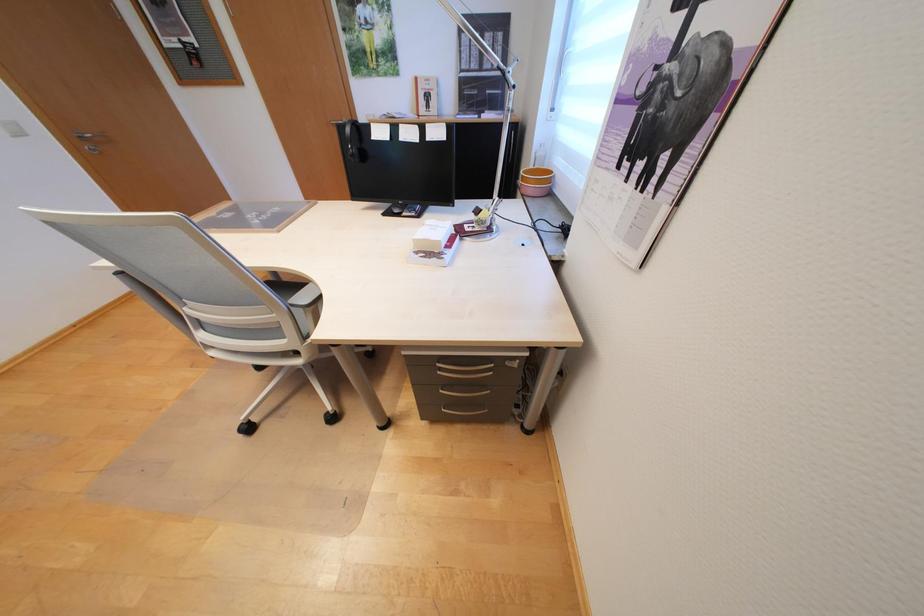
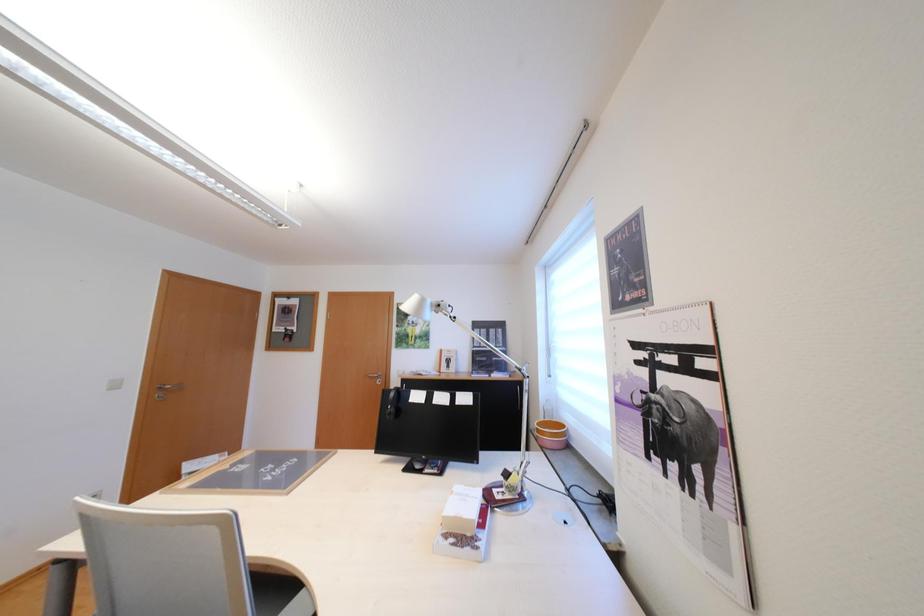
Question: Based on the continuous images, in which direction is the camera rotating? Reply with the corresponding letter.

Choices:
 (A) Left
 (B) Right
 (C) Up
 (D) Down

Answer: (C)